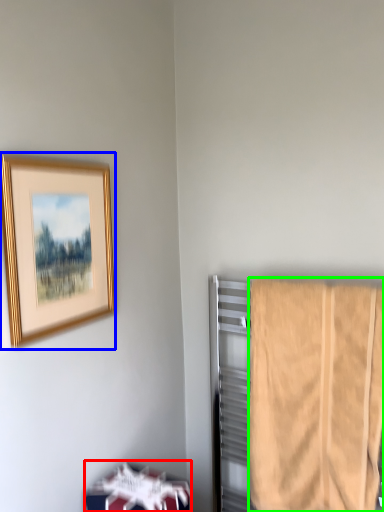
Question: Which object is positioned farthest from furniture (highlighted by a red box)? Select from picture frame (highlighted by a blue box) and towel (highlighted by a green box).

Choices:
 (A) picture frame
 (B) towel

Answer: (A)